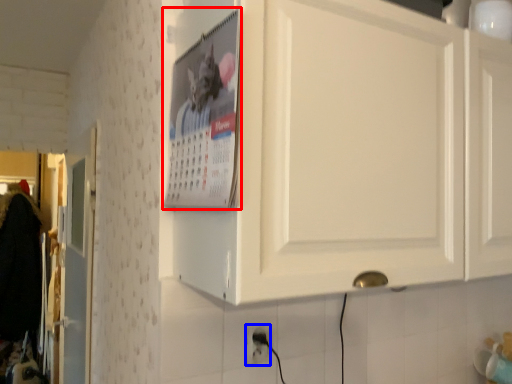
Question: Which object appears farthest to the camera in this image, poster page (highlighted by a red box) or electric outlet (highlighted by a blue box)?

Choices:
 (A) poster page
 (B) electric outlet

Answer: (B)